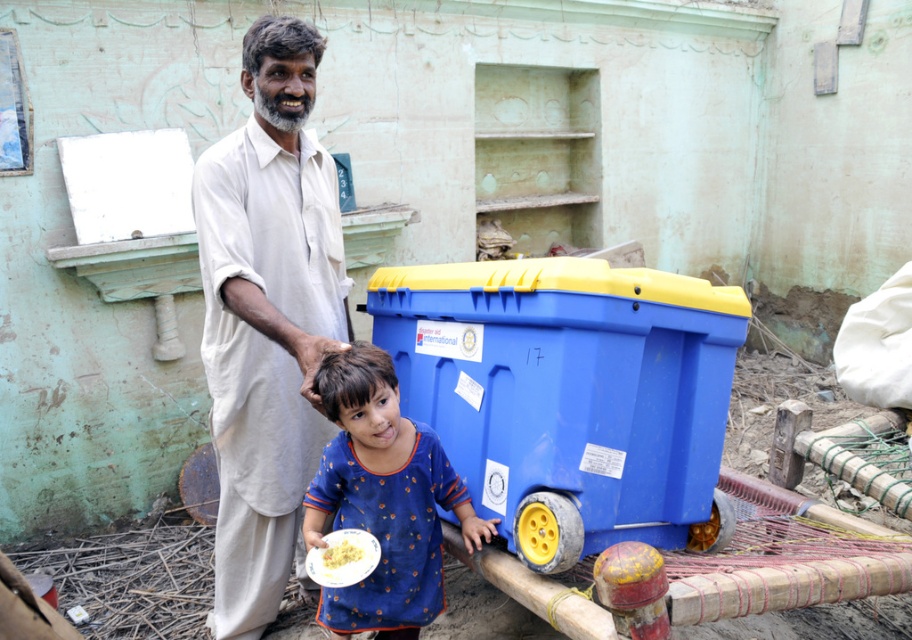
Is light beige cotton shirt at center to the left of blue printed shirt at center from the viewer's perspective?

Indeed, light beige cotton shirt at center is positioned on the left side of blue printed shirt at center.

Locate an element on the screen. This screenshot has height=640, width=912. light beige cotton shirt at center is located at coordinates (267, 316).

Between blue plastic recycling bin at lower right and light beige cotton shirt at center, which one appears on the right side from the viewer's perspective?

blue plastic recycling bin at lower right is more to the right.

How far apart are blue plastic recycling bin at lower right and light beige cotton shirt at center?

They are 60.73 centimeters apart.

Is point (658, 467) positioned before point (309, 150)?

Yes, point (658, 467) is closer to viewer.

Where is `blue plastic recycling bin at lower right`? The width and height of the screenshot is (912, 640). blue plastic recycling bin at lower right is located at coordinates (567, 392).

Can you confirm if blue plastic recycling bin at lower right is positioned above blue printed shirt at center?

Yes.

Between blue plastic recycling bin at lower right and blue printed shirt at center, which one is positioned higher?

blue plastic recycling bin at lower right is above.

In the scene shown: Who is more distant from viewer, (541, 400) or (399, 568)?

The point (399, 568) is more distant.

The width and height of the screenshot is (912, 640). Identify the location of blue plastic recycling bin at lower right. (567, 392).